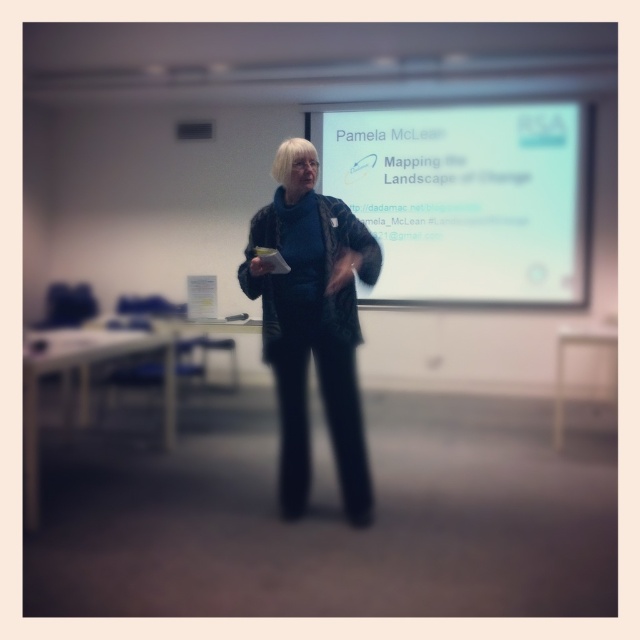
You are an event organizer setting up a new projector. The projector you have can project an image up to 3 meters away. Based on the scene, will the projector be able to reach the white glossy projector screen at upper center from the position of the black textured jacket at center?

The distance between the white glossy projector screen at upper center and the black textured jacket at center is 2.97 meters, which is within the projector maximum range of 3 meters. Therefore, the projector can reach the white glossy projector screen at upper center from the position of the black textured jacket at center.

You are setting up a camera to capture the presenter and the projection screen. The camera has a fixed position and can only focus on objects within a 0.25 unit radius. Given the coordinates of the white glossy projector screen at upper center, will the camera be able to focus on both the presenter and the screen simultaneously?

The white glossy projector screen at upper center is located at point (467, 196). Since the camera can only focus on objects within a 0.25 unit radius, the distance between the presenter and the screen must be calculated. If the presenter is positioned at the camera location, the screen is 0.309 units away horizontally and 0.730 vertically. The total distance is sqrt squared distance exceeds 0.25 units, so the camera cannot focus on both simultaneously.

You are setting up a camera to film the presentation. The camera has a wide angle lens that can capture objects up to 2 meters wide. You need to frame both the white glossy projector screen at upper center and the black textured jacket at center in the shot. Based on their sizes, will the camera be able to capture both objects in the same frame?

The white glossy projector screen at upper center might be wider than the black textured jacket at center, but since the camera can capture up to 2 meters wide, it depends on the actual width of the screen. If the screen is within 2 meters, both can be captured.